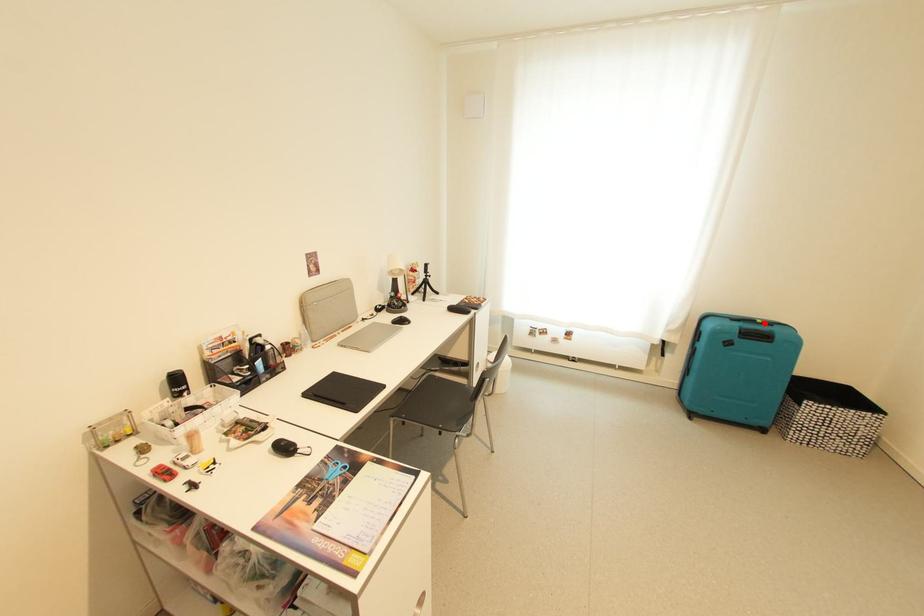
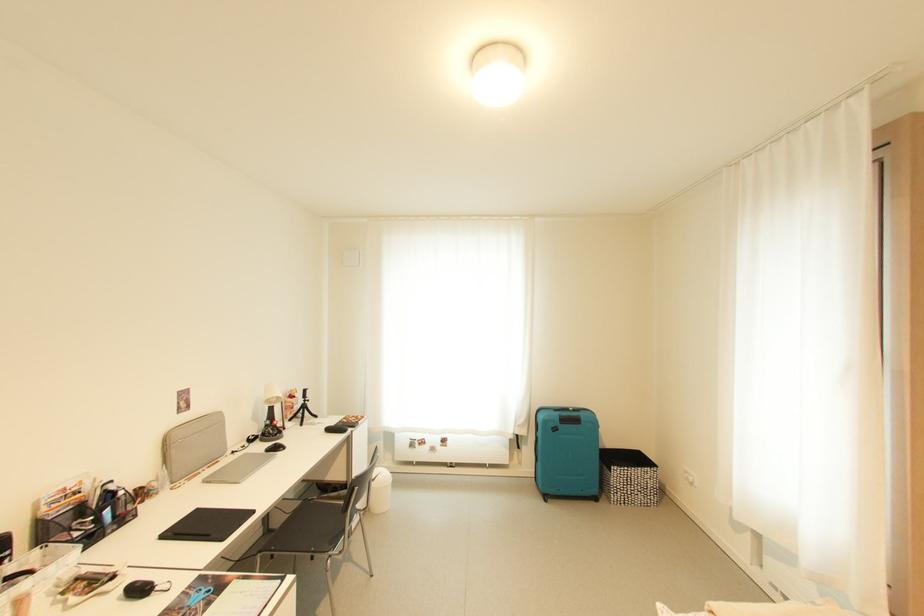
Where in the second image is the point corresponding to the highlighted location from the first image?

(576, 411)